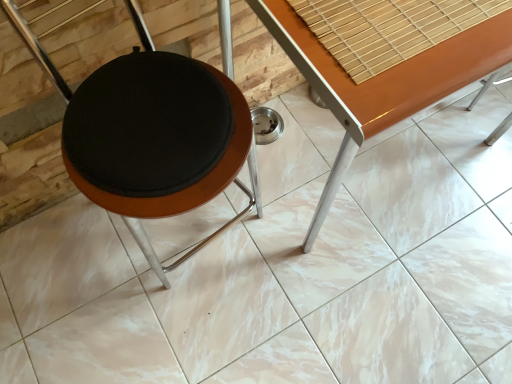
You are a GUI agent. You are given a task and a screenshot of the screen. Output one action in this format:
    pyautogui.click(x=<x>, y=<y>)
    Task: Click on the free space below wooden glossy table at center (from a real-world perspective)
    Image resolution: width=512 pixels, height=384 pixels.
    Given the screenshot: What is the action you would take?
    [353, 162]